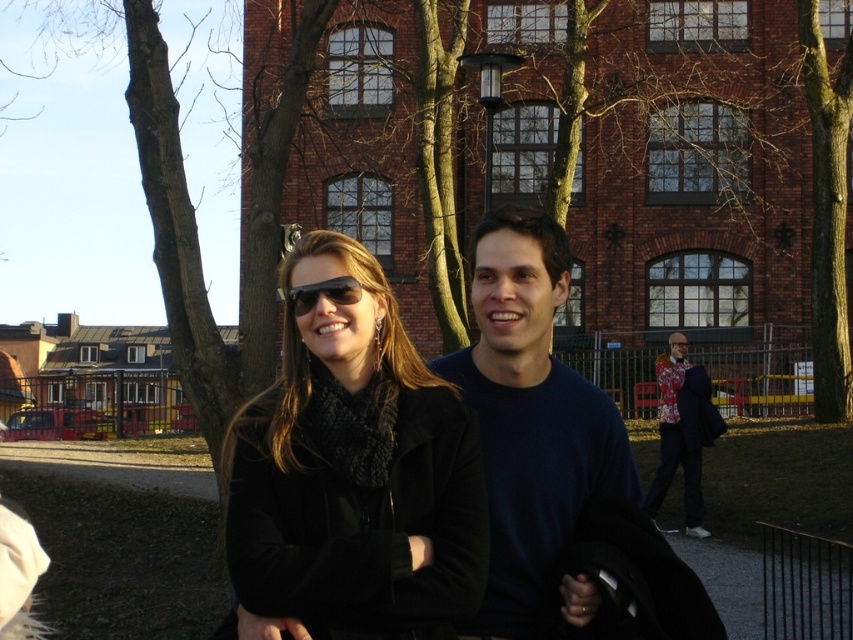
You are taking a photo of two people standing in front of a red brick building. You need to ensure that both the dark blue sweater at center and the matte black sunglasses at center are visible in the frame. Based on their positions, which object is on the right side?

The dark blue sweater at center is positioned on the right side of the matte black sunglasses at center, so the dark blue sweater at center is on the right.

You are a photographer trying to capture a group photo of the dark blue sweater at center and the floral fabric jacket at lower right. If you want to ensure both subjects are fully visible in the frame, which subject should you position closer to the camera to maintain their visibility?

The floral fabric jacket at lower right should be positioned closer to the camera because its width is smaller than the dark blue sweater at center, allowing it to be seen clearly even when nearer.

You are a photographer trying to capture a photo of the two people in front of the red brick building. You want to ensure both the black matte jacket at center and the matte black sunglasses at center are clearly visible. Given their sizes, which object should you focus on to ensure it remains in sharp focus even if the other is slightly out of focus?

The black matte jacket at center has a larger width than the matte black sunglasses at center, so focusing on the black matte jacket at center ensures it stays in sharp focus even if the sunglasses are slightly out of focus.